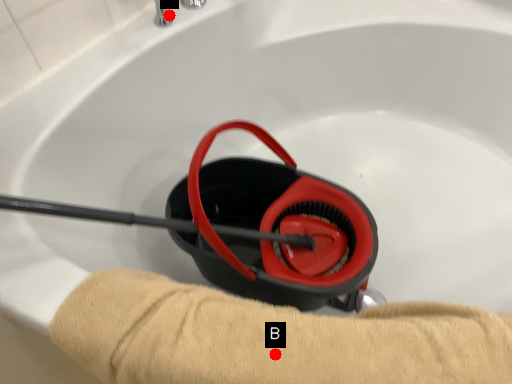
Question: Two points are circled on the image, labeled by A and B beside each circle. Which point appears farthest from the camera in this image?

Choices:
 (A) A is further
 (B) B is further

Answer: (A)